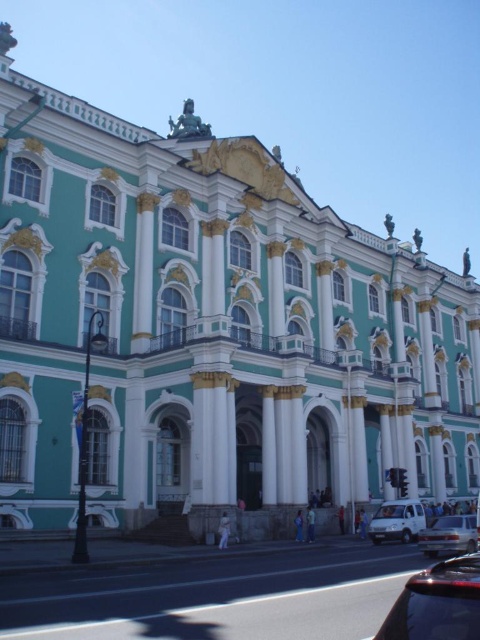
You are a photographer planning to capture the grand entrance of the building. You have two vehicles, a shiny black car at lower right and a white matte van at lower right, parked near the entrance. To ensure the vehicles don not block the view of the entrance, which vehicle should you move further away?

The shiny black car at lower right is wider than the white matte van at lower right. Therefore, you should move the shiny black car at lower right further away to avoid blocking the entrance view.